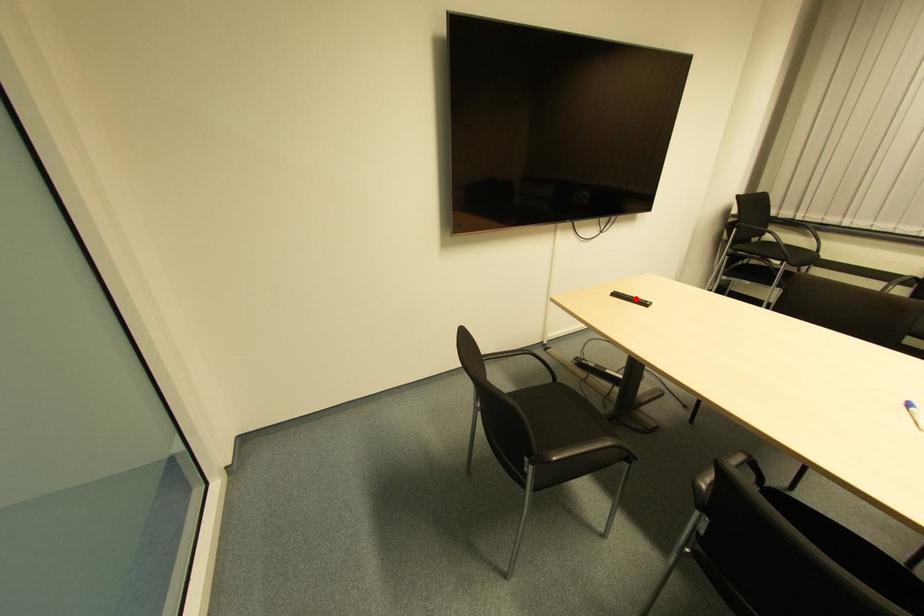
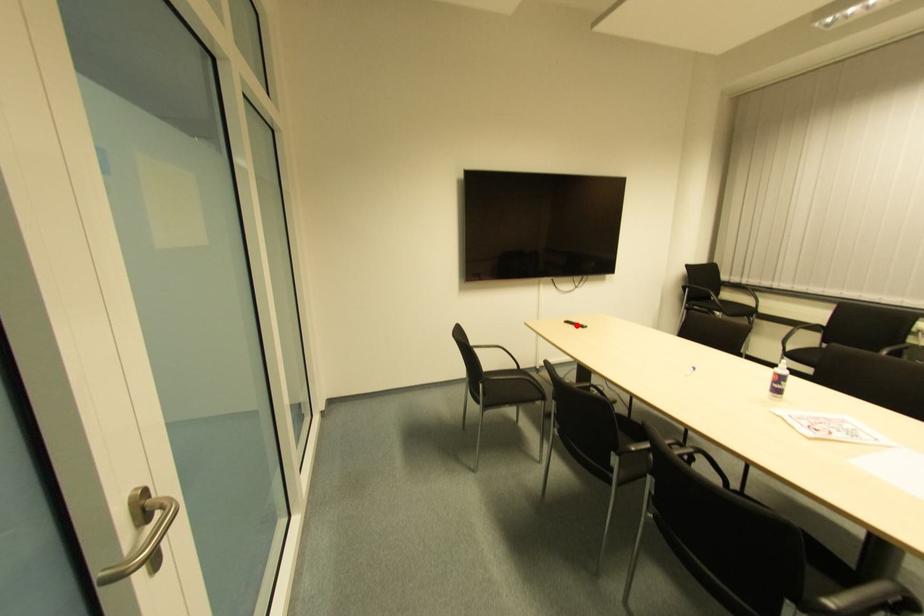
I am providing you with two images of the same scene from different viewpoints. A red point is marked on the first image and another point is marked on the second image. Does the point marked in image1 correspond to the same location as the one in image2?

Yes